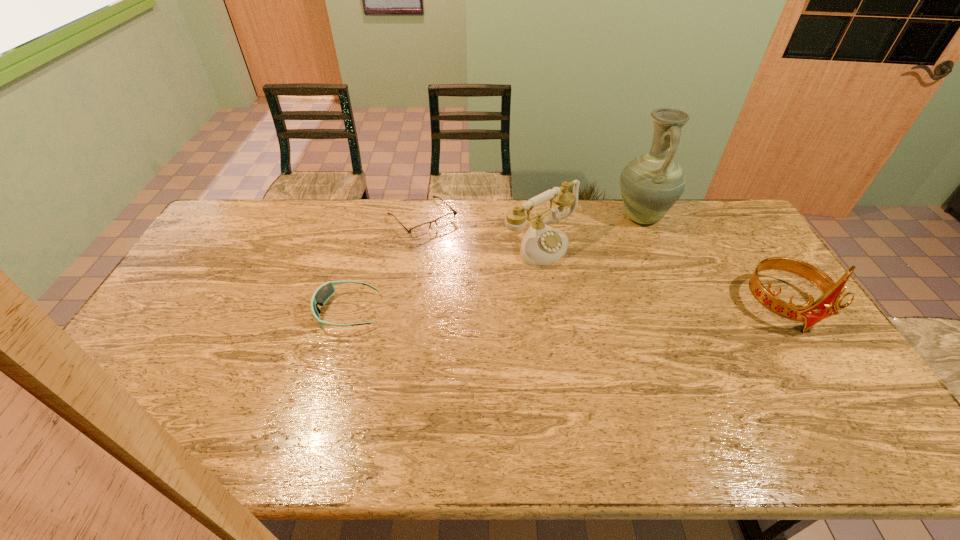
Locate an element on the screen. vacant space at the near right corner of the desktop is located at coordinates (830, 389).

Identify the location of blank region between the tiara and the spectacles. (604, 262).

This screenshot has height=540, width=960. I want to click on empty space that is in between the third tallest object and the second object from right to left, so click(590, 230).

Identify the location of free spot between the pitcher and the telephone. (590, 230).

Image resolution: width=960 pixels, height=540 pixels. I want to click on free spot between the spectacles and the second tallest object, so click(604, 262).

Where is `vacant space that is in between the fourth object from left to right and the spectacles`? This screenshot has height=540, width=960. vacant space that is in between the fourth object from left to right and the spectacles is located at coordinates (532, 217).

Find the location of a particular element. free space between the telephone and the goggles is located at coordinates click(x=444, y=276).

I want to click on free spot between the shortest object and the fourth tallest object, so click(385, 265).

I want to click on vacant space in between the pitcher and the third shortest object, so click(x=590, y=230).

Where is `vacant space that is in between the fourth tallest object and the rightmost object`? This screenshot has width=960, height=540. vacant space that is in between the fourth tallest object and the rightmost object is located at coordinates (566, 309).